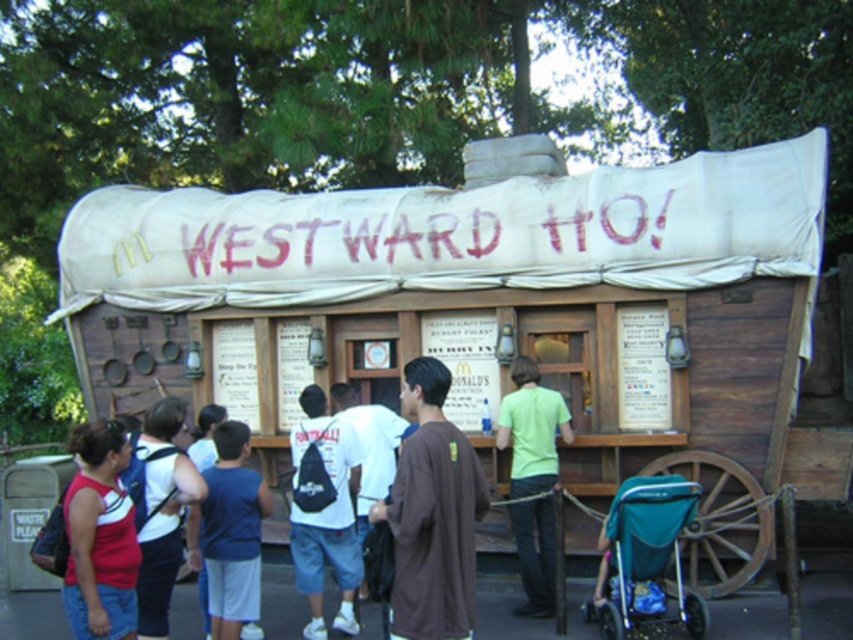
Between matte red tank top at lower left and blue fabric shirt at lower left, which one is positioned lower?

blue fabric shirt at lower left is lower down.

Who is shorter, matte red tank top at lower left or blue fabric shirt at lower left?

matte red tank top at lower left

Is point (105, 605) closer to viewer compared to point (209, 522)?

Yes, point (105, 605) is closer to viewer.

What are the coordinates of `matte red tank top at lower left` in the screenshot? It's located at (100, 538).

Between point (695, 636) and point (247, 563), which one is positioned behind?

The point (695, 636) is more distant.

Can you confirm if teal fabric stroller at lower right is positioned above blue fabric shirt at lower left?

No, teal fabric stroller at lower right is not above blue fabric shirt at lower left.

Identify the location of teal fabric stroller at lower right. This screenshot has height=640, width=853. (646, 556).

You are a GUI agent. You are given a task and a screenshot of the screen. Output one action in this format:
    pyautogui.click(x=<x>, y=<y>)
    Task: Click on the teal fabric stroller at lower right
    
    Given the screenshot: What is the action you would take?
    tap(646, 556)

Does matte red tank top at lower left appear over light green t-shirt at center?

Correct, matte red tank top at lower left is located above light green t-shirt at center.

Where is `matte red tank top at lower left`? The height and width of the screenshot is (640, 853). matte red tank top at lower left is located at coordinates (100, 538).

Locate an element on the screen. matte red tank top at lower left is located at coordinates (100, 538).